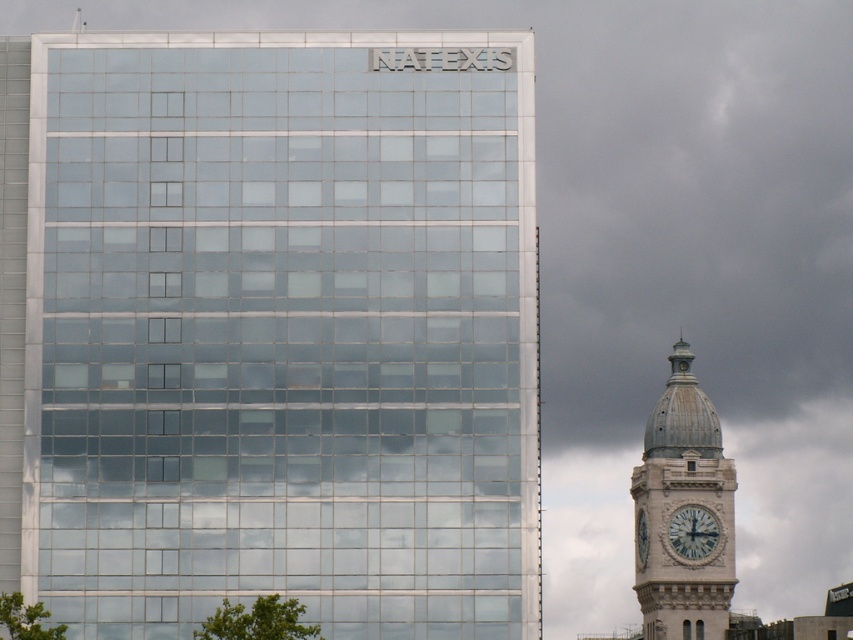
You are an architect analyzing the image of two clock towers. The scene includes a light gray stone clock tower at right and a white stone clock at right. Which one has a greater width?

The light gray stone clock tower at right has a greater width than the white stone clock at right according to the description.

You are standing in front of the two structures and want to determine which point is nearer to you. The first point is at coordinate point (94, 224) and the second is at point (657, 548). Which point is closer to you?

The point at coordinate point (94, 224) is closer to the viewer than point (657, 548).

You are standing at the base of the transparent glass building at upper left and want to see the top of the light gray stone clock tower at right. Can you see the entire clock tower from your current position?

The transparent glass building at upper left is taller than the light gray stone clock tower at right, so you cannot see the entire clock tower from your current position because the building blocks the view.